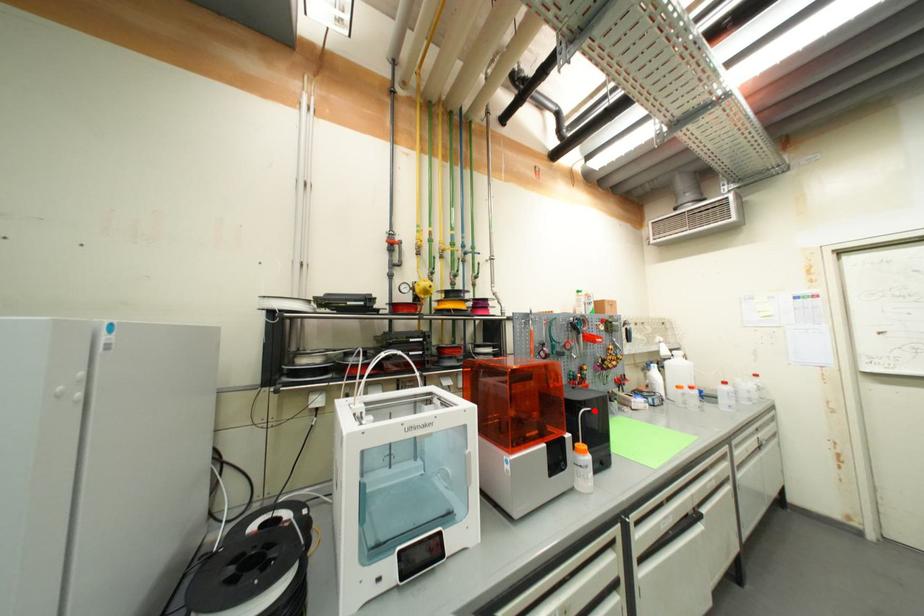
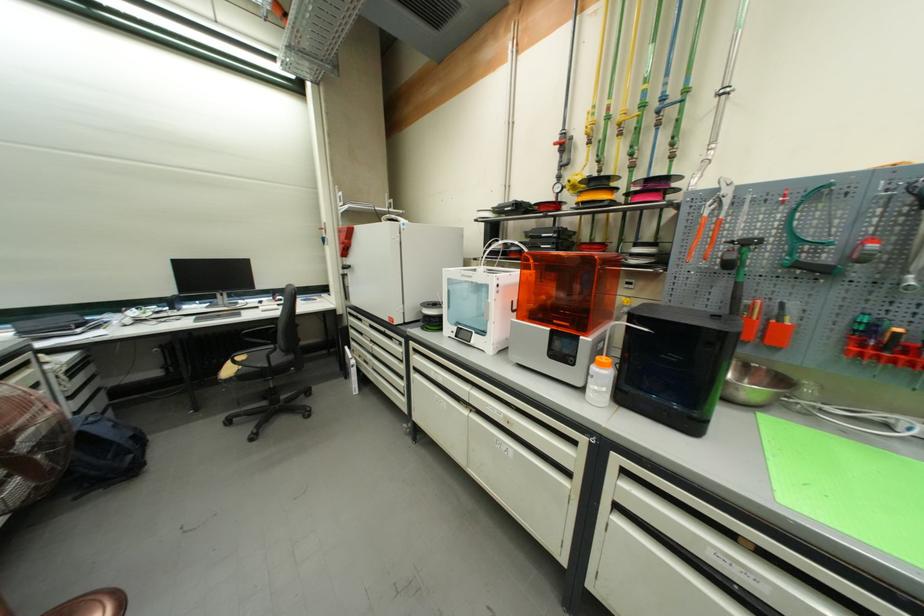
In the second image, find the point that corresponds to the highlighted location in the first image.

(651, 331)